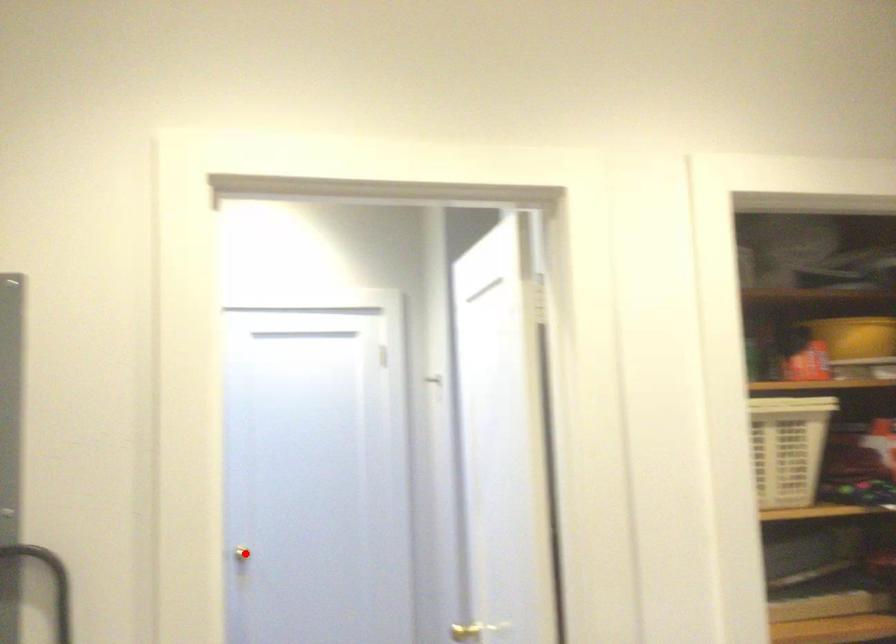
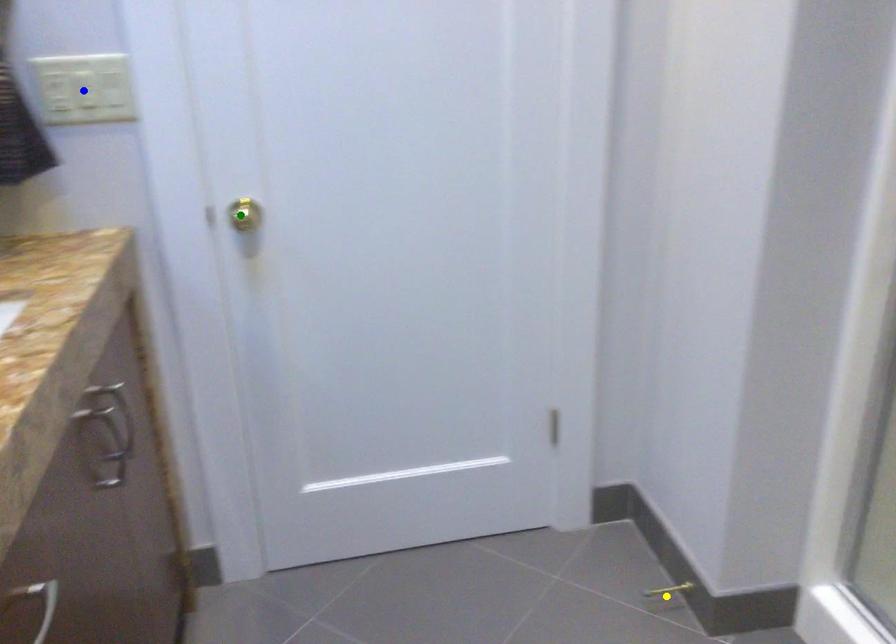
Question: I am providing you with two images of the same scene from different viewpoints. A red point is marked on the first image. You are given multiple points on the second image. Which point in image 2 represents the same 3d spot as the red point in image 1?

Choices:
 (A) yellow point
 (B) blue point
 (C) green point

Answer: (C)